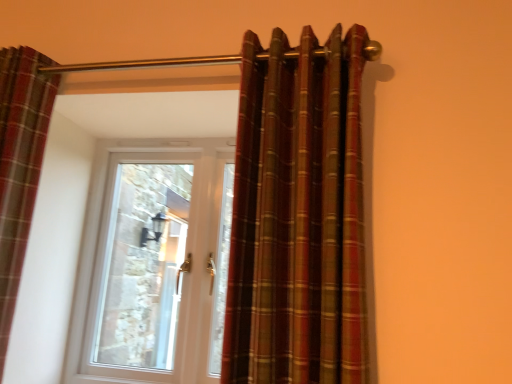
Question: From the image's perspective, is white plastic door at center beneath plaid fabric curtain at center, positioned as the 1th curtain in right-to-left order?

Choices:
 (A) yes
 (B) no

Answer: (A)

Question: Considering the relative sizes of white plastic door at center and plaid fabric curtain at center, positioned as the 1th curtain in right-to-left order, in the image provided, is white plastic door at center shorter than plaid fabric curtain at center, positioned as the 1th curtain in right-to-left order,?

Choices:
 (A) yes
 (B) no

Answer: (B)

Question: Can you confirm if white plastic door at center is wider than plaid fabric curtain at center, positioned as the 1th curtain in right-to-left order?

Choices:
 (A) yes
 (B) no

Answer: (B)

Question: Is white plastic door at center surrounding plaid fabric curtain at center, the 2th curtain in the left-to-right sequence?

Choices:
 (A) yes
 (B) no

Answer: (B)

Question: From a real-world perspective, is white plastic door at center physically above plaid fabric curtain at center, the 2th curtain in the left-to-right sequence?

Choices:
 (A) no
 (B) yes

Answer: (A)

Question: From a real-world perspective, relative to white plastic door at center, is plaid fabric curtain at left, which is counted as the first curtain, starting from the left, vertically above or below?

Choices:
 (A) above
 (B) below

Answer: (A)

Question: Do you think plaid fabric curtain at left, which ranks as the second curtain in right-to-left order, is within white plastic door at center, or outside of it?

Choices:
 (A) inside
 (B) outside

Answer: (B)

Question: Is plaid fabric curtain at left, which is counted as the first curtain, starting from the left, in front of or behind white plastic door at center in the image?

Choices:
 (A) front
 (B) behind

Answer: (A)

Question: Considering the positions of point (2, 188) and point (205, 375), is point (2, 188) closer or farther from the camera than point (205, 375)?

Choices:
 (A) closer
 (B) farther

Answer: (A)

Question: Considering the positions of point (138, 283) and point (330, 211), is point (138, 283) closer or farther from the camera than point (330, 211)?

Choices:
 (A) closer
 (B) farther

Answer: (B)

Question: From a real-world perspective, relative to plaid fabric curtain at center, the 2th curtain in the left-to-right sequence, is white plastic door at center vertically above or below?

Choices:
 (A) above
 (B) below

Answer: (B)

Question: Considering the relative positions of white plastic door at center and plaid fabric curtain at center, positioned as the 1th curtain in right-to-left order, in the image provided, is white plastic door at center to the left or to the right of plaid fabric curtain at center, positioned as the 1th curtain in right-to-left order,?

Choices:
 (A) left
 (B) right

Answer: (A)

Question: Considering the positions of white plastic door at center and plaid fabric curtain at center, the 2th curtain in the left-to-right sequence, in the image, is white plastic door at center wider or thinner than plaid fabric curtain at center, the 2th curtain in the left-to-right sequence,?

Choices:
 (A) wide
 (B) thin

Answer: (B)

Question: In the image, is plaid fabric curtain at center, the 2th curtain in the left-to-right sequence, positioned in front of or behind plaid fabric curtain at left, which ranks as the second curtain in right-to-left order?

Choices:
 (A) front
 (B) behind

Answer: (A)

Question: From a real-world perspective, is plaid fabric curtain at center, the 2th curtain in the left-to-right sequence, above or below plaid fabric curtain at left, which is counted as the first curtain, starting from the left?

Choices:
 (A) below
 (B) above

Answer: (B)